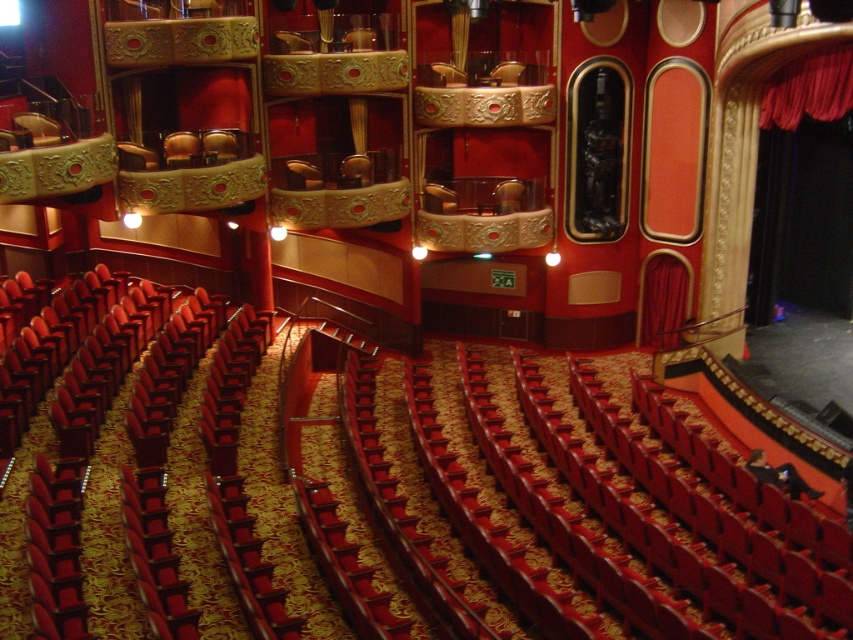
Question: Is red velvet curtain at upper right closer to the viewer compared to matte gold chair at upper center?

Choices:
 (A) no
 (B) yes

Answer: (B)

Question: Which of the following is the closest to the observer?

Choices:
 (A) (195, 147)
 (B) (798, 120)

Answer: (B)

Question: Where is red velvet curtain at upper right located in relation to matte gold chair at upper center in the image?

Choices:
 (A) below
 (B) above

Answer: (B)

Question: Is red velvet curtain at upper right further to the viewer compared to matte gold chair at upper center?

Choices:
 (A) yes
 (B) no

Answer: (B)